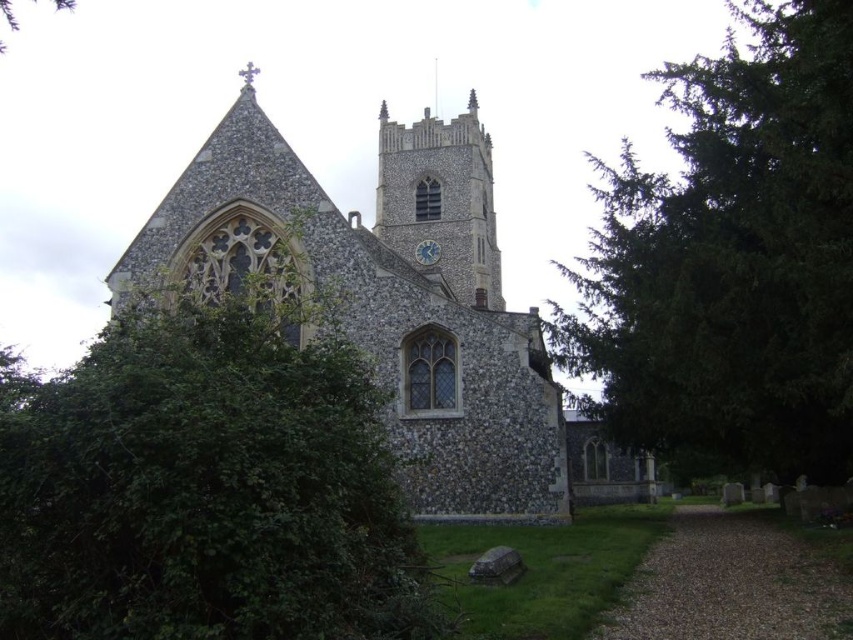
You are standing at the entrance of the church and want to take a photo of the prominent clock face on the tower. However, there is a green leafy bush at left blocking the view. Based on the coordinates provided, can you determine if the bush is in the way of the clock face?

The green leafy bush at left is located at coordinates (206, 486), which is to the left side of the image. Since the prominent clock face is near the center of the tower, the bush at left is not directly blocking the view of the clock face.

You are standing at the entrance of the traditional stone church and want to take a photo of the prominent clock face on the tower. There is a green textured tree at right in the way. Where should you move to get an unobstructed view of the clock face?

You should move to the left side of the green textured tree at right to avoid the obstruction, as the tree is positioned at point (732, 260), which might be blocking the view from the entrance.